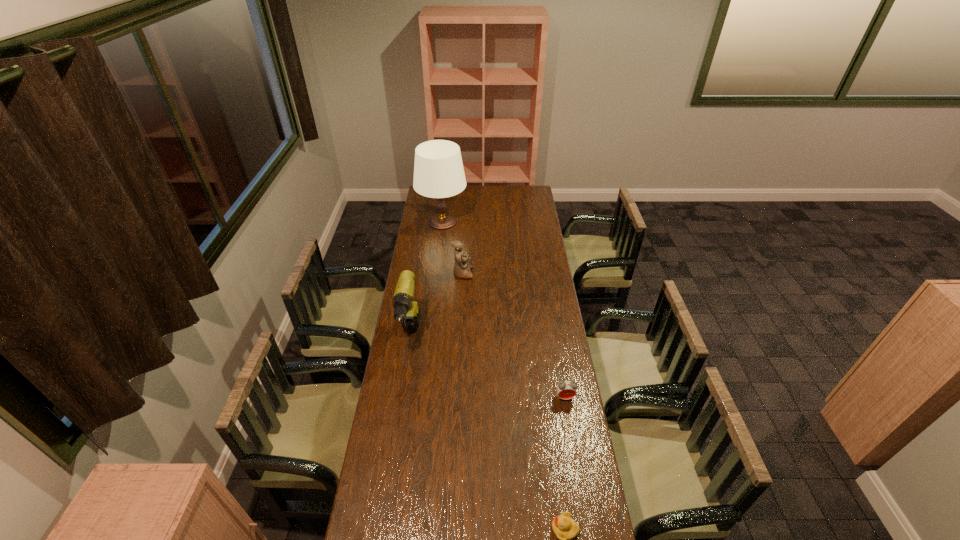
Where is `free space between the second farthest object and the fourth tallest object`? Image resolution: width=960 pixels, height=540 pixels. free space between the second farthest object and the fourth tallest object is located at coordinates (514, 335).

This screenshot has height=540, width=960. Find the location of `free space between the lamp and the second tallest object`. free space between the lamp and the second tallest object is located at coordinates (426, 279).

The height and width of the screenshot is (540, 960). What are the coordinates of `the third closest object relative to the second nearest object` in the screenshot? It's located at (462, 266).

Locate an element on the screen. object that is the third closest to the figurine is located at coordinates (566, 389).

Image resolution: width=960 pixels, height=540 pixels. What are the coordinates of `vacant region that satisfies the following two spatial constraints: 1. on the front-facing side of the figurine; 2. on the handle side of the third nearest object` in the screenshot? It's located at (459, 337).